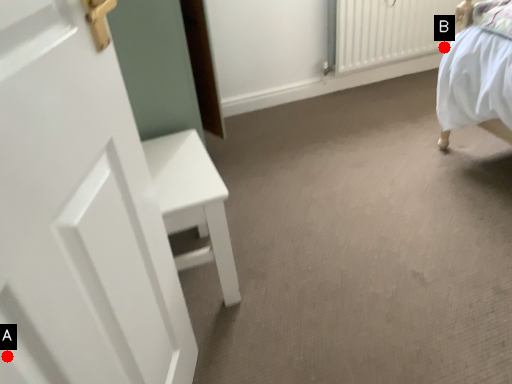
Question: Two points are circled on the image, labeled by A and B beside each circle. Which point is closer to the camera taking this photo?

Choices:
 (A) A is closer
 (B) B is closer

Answer: (A)